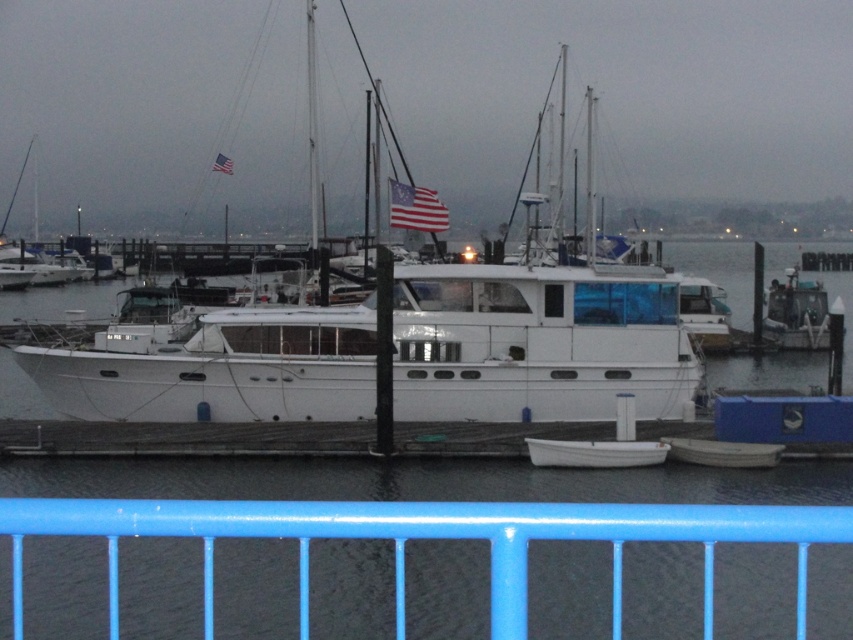
You are a photographer planning to capture the white matte boat at center and the white glossy boat at center from a position on the blue railing in the foreground. Which boat will appear higher in your photo?

The white matte boat at center will appear higher in the photo because it is positioned above the white glossy boat at center.

You are standing on the blue railing in the foreground of the marina scene. You see a point marked at coordinates (x=404, y=349). What object is located at this point?

The point at coordinates (x=404, y=349) marks the white matte boat at center.

You are standing on the blue railing in the foreground of the marina scene. You see the white matte water at center and the white glossy boat at center. Which object is positioned to the right of the other?

The white matte water at center is to the right of the white glossy boat at center.